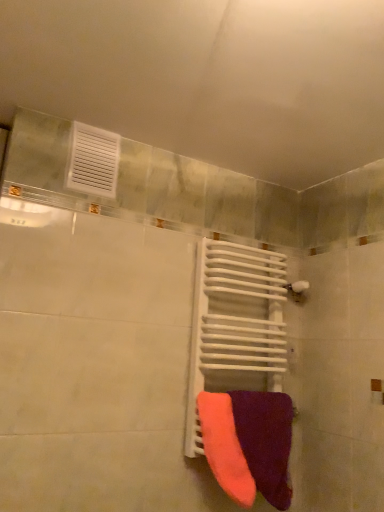
Question: Would you say velvet purple towel at lower right, which is the 2th towel from left to right, is to the left or to the right of neon orange fabric towel at center, which is the first towel from left to right, in the picture?

Choices:
 (A) right
 (B) left

Answer: (A)

Question: Is velvet purple towel at lower right, which is the 2th towel from left to right, wider or thinner than neon orange fabric towel at center, which is the first towel from left to right?

Choices:
 (A) thin
 (B) wide

Answer: (B)

Question: Based on their relative distances, which object is farther from the white metallic radiator at center?

Choices:
 (A) velvet purple towel at lower right, which is the 2th towel from left to right
 (B) neon orange fabric towel at center, which is the second towel from right to left

Answer: (B)

Question: Which of these objects is positioned closest to the velvet purple towel at lower right, arranged as the 1th towel when viewed from the right?

Choices:
 (A) white metallic radiator at center
 (B) neon orange fabric towel at center, which is the first towel from left to right

Answer: (B)